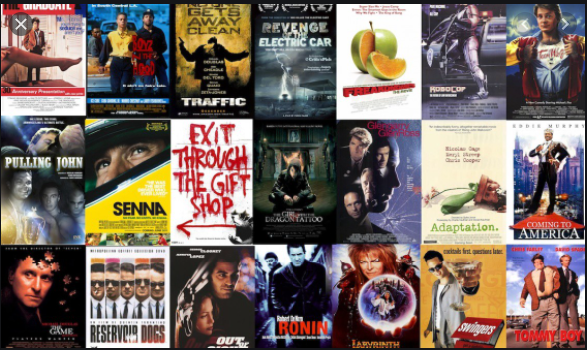
Locate an element on the screen. The height and width of the screenshot is (350, 587). total number of movie posters on the middle row is located at coordinates (43, 191), (148, 182), (212, 182), (288, 179), (380, 181), (470, 182), (545, 180).